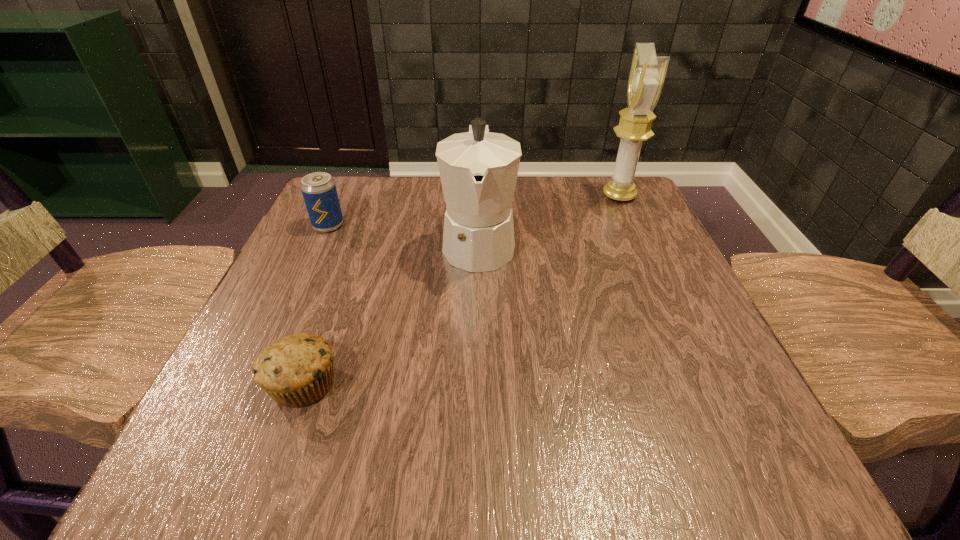
Identify the location of free region located 0.220m at the spout of the third object from left to right. (478, 382).

Where is `free spot located on the right of the beer can`? This screenshot has height=540, width=960. free spot located on the right of the beer can is located at coordinates (449, 226).

You are a GUI agent. You are given a task and a screenshot of the screen. Output one action in this format:
    pyautogui.click(x=<x>, y=<y>)
    Task: Click on the vacant space located on the back of the muffin
    The width and height of the screenshot is (960, 540).
    Given the screenshot: What is the action you would take?
    pyautogui.click(x=330, y=310)

Locate an element on the screen. award located at the far edge is located at coordinates (647, 73).

Locate an element on the screen. coffeepot situated at the far edge is located at coordinates (478, 169).

The height and width of the screenshot is (540, 960). What are the coordinates of `beer can that is at the far edge` in the screenshot? It's located at (319, 191).

This screenshot has width=960, height=540. I want to click on beer can situated at the left edge, so (x=319, y=191).

You are a GUI agent. You are given a task and a screenshot of the screen. Output one action in this format:
    pyautogui.click(x=<x>, y=<y>)
    Task: Click on the muffin at the left edge
    The image size is (960, 540).
    Given the screenshot: What is the action you would take?
    pyautogui.click(x=297, y=370)

I want to click on object that is at the right edge, so click(x=647, y=73).

The height and width of the screenshot is (540, 960). Find the location of `object located at the far left corner`. object located at the far left corner is located at coordinates (319, 191).